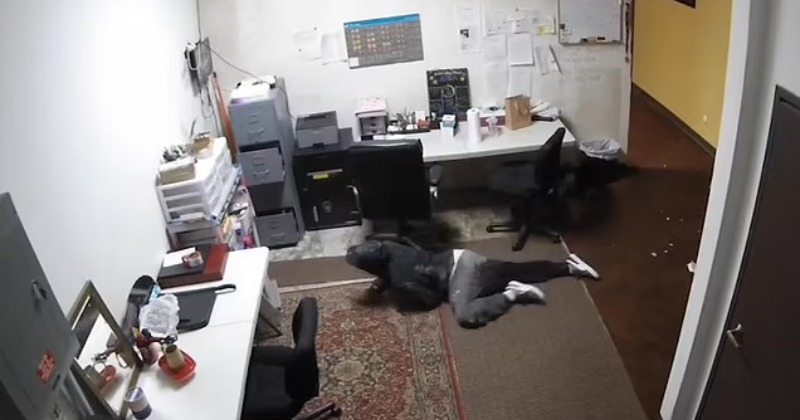
Image resolution: width=800 pixels, height=420 pixels. I want to click on dry erase whiteboard, so click(x=586, y=12).